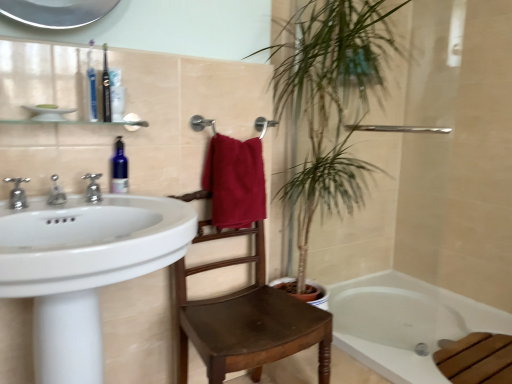
Question: Considering their positions, is translucent plastic toothbrush at upper left, placed as the first toiletry when sorted from back to front, located in front of or behind white glossy sink at left?

Choices:
 (A) behind
 (B) front

Answer: (A)

Question: Considering the positions of translucent plastic toothbrush at upper left, placed as the first toiletry when sorted from back to front, and white glossy sink at left in the image, is translucent plastic toothbrush at upper left, placed as the first toiletry when sorted from back to front, bigger or smaller than white glossy sink at left?

Choices:
 (A) big
 (B) small

Answer: (B)

Question: Which object is positioned farthest from the green leafy plant at upper center?

Choices:
 (A) silver metallic faucet at left, the 2th tap in the right-to-left sequence
 (B) blue plastic toothbrush at upper left, the 1th toiletry from the front
 (C) translucent plastic toothbrush at upper left, placed as the first toiletry when sorted from back to front
 (D) blue glass soap dispenser at upper left
 (E) dark brown wooden chair at center

Answer: (A)

Question: Estimate the real-world distances between objects in this image. Which object is farther from the silver metallic faucet at left, marked as the second tap in a left-to-right arrangement?

Choices:
 (A) white glossy sink at left
 (B) dark brown wooden chair at center
 (C) blue glass soap dispenser at upper left
 (D) green leafy plant at upper center
 (E) polished chrome faucet at left, acting as the first tap starting from the right

Answer: (D)